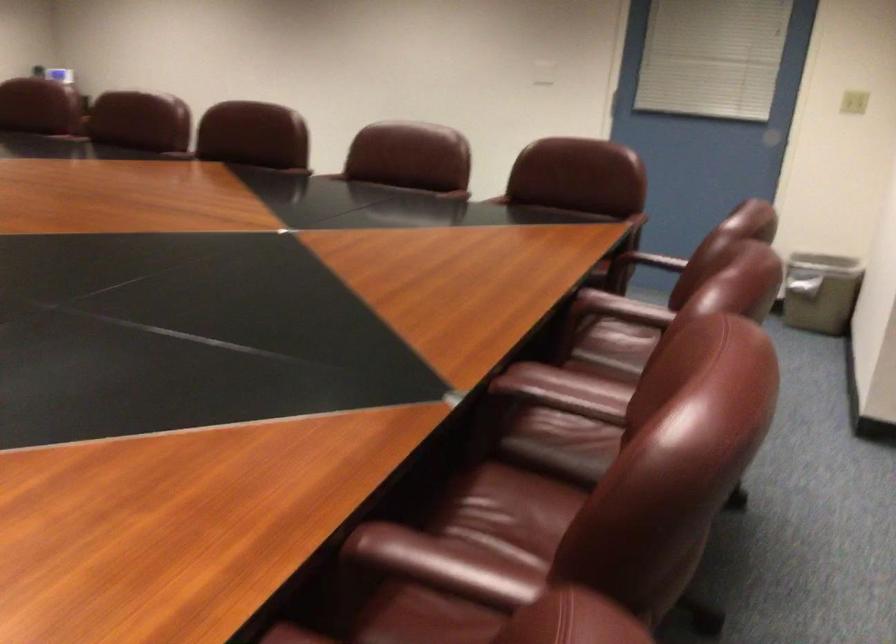
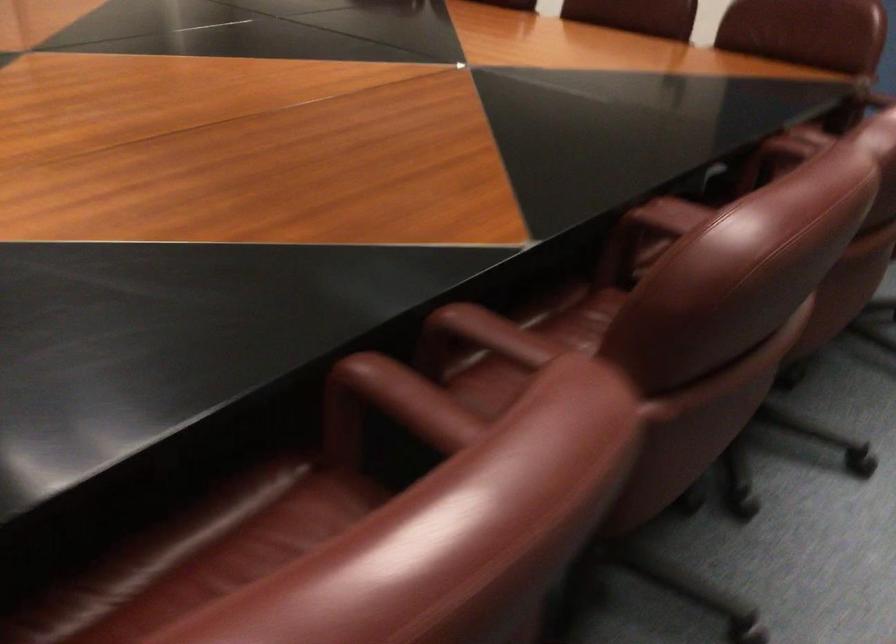
The point at (290, 158) is marked in the first image. Where is the corresponding point in the second image?

(528, 344)